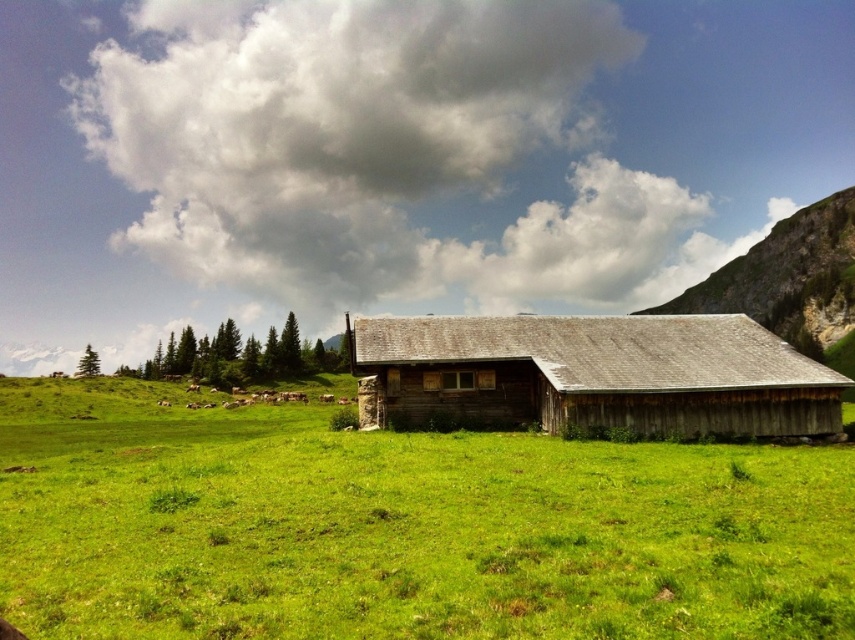
You are standing at the edge of the meadow and want to reach the green grassy field at center. Which direction should you walk to get there?

The green grassy field at center is located at point (401, 528), so you should walk towards the center of the meadow to reach it.